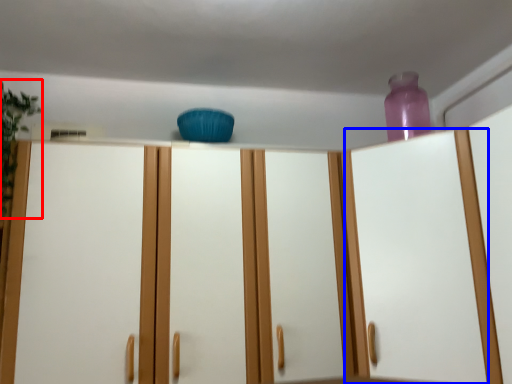
Question: Which of the following is the farthest to the observer, plant (highlighted by a red box) or glass door (highlighted by a blue box)?

Choices:
 (A) plant
 (B) glass door

Answer: (A)